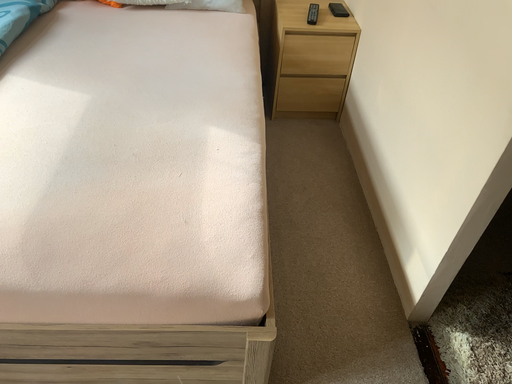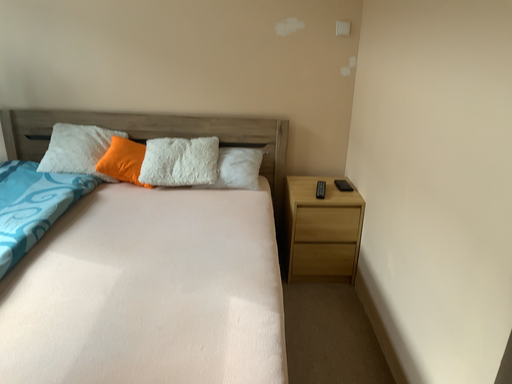
Question: Which way did the camera rotate in the video?

Choices:
 (A) rotated upward
 (B) rotated downward

Answer: (A)